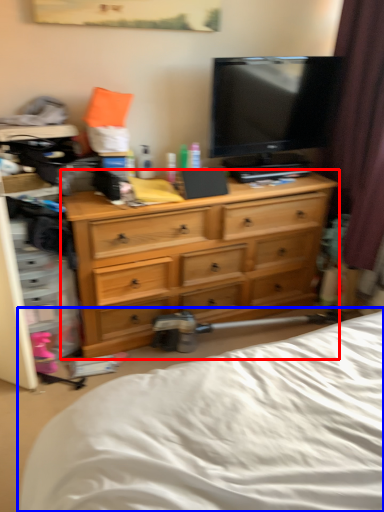
Question: Which object is further to the camera taking this photo, chest of drawers (highlighted by a red box) or bed (highlighted by a blue box)?

Choices:
 (A) chest of drawers
 (B) bed

Answer: (A)